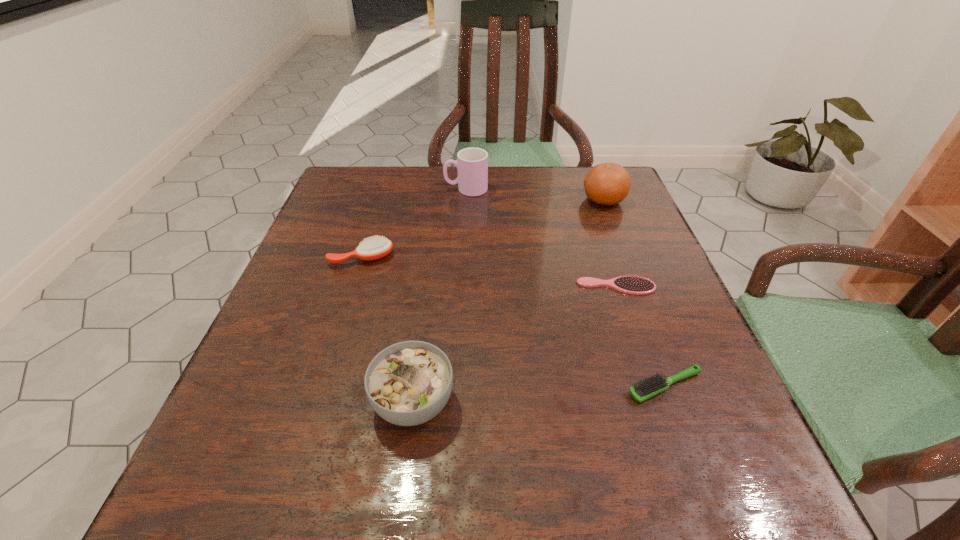
The width and height of the screenshot is (960, 540). What are the coordinates of `free location located 0.180m with the handle on the side of the cup` in the screenshot? It's located at (374, 189).

Find the location of a particular element. Image resolution: width=960 pixels, height=540 pixels. vacant region located with the handle on the side of the cup is located at coordinates (340, 189).

Find the location of a particular element. The height and width of the screenshot is (540, 960). free space located on the left of the clementine is located at coordinates (534, 200).

Locate an element on the screen. vacant space located on the right of the third tallest object is located at coordinates (x=560, y=402).

The image size is (960, 540). Find the location of `vacant space located 0.170m on the right of the leftmost hairbrush`. vacant space located 0.170m on the right of the leftmost hairbrush is located at coordinates (473, 258).

The image size is (960, 540). I want to click on vacant space located 0.330m on the left of the fifth tallest object, so coord(417,386).

Where is `free location located 0.110m on the front of the shortest object`? The height and width of the screenshot is (540, 960). free location located 0.110m on the front of the shortest object is located at coordinates (634, 340).

Identify the location of cup at the far edge. The height and width of the screenshot is (540, 960). (472, 163).

You are a GUI agent. You are given a task and a screenshot of the screen. Output one action in this format:
    pyautogui.click(x=<x>, y=<y>)
    Task: Click on the clementine that is at the far edge
    This screenshot has width=960, height=540.
    Given the screenshot: What is the action you would take?
    pyautogui.click(x=608, y=183)

Find the location of a particular element. object at the left edge is located at coordinates (375, 248).